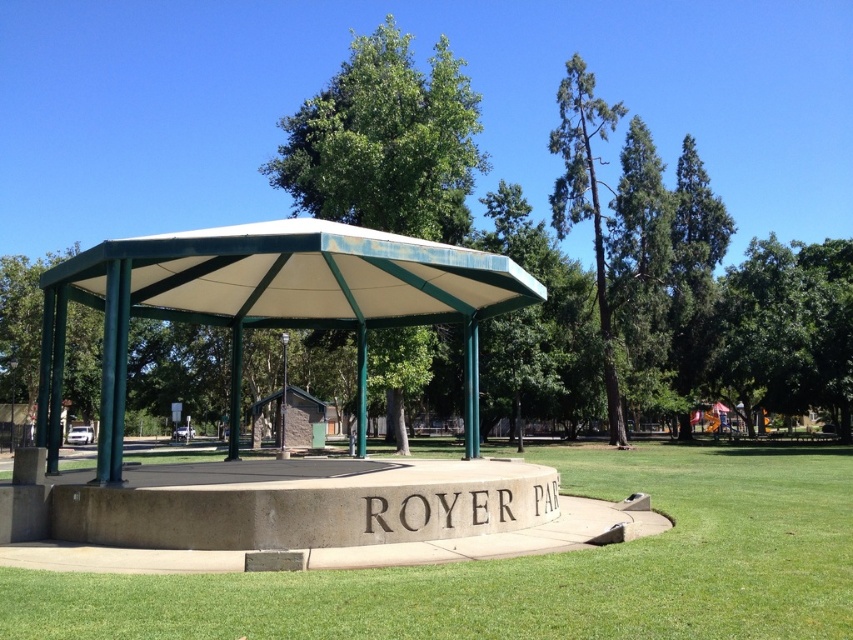
Is green fabric canopy at center taller than green textured tree at upper right?

No, green fabric canopy at center is not taller than green textured tree at upper right.

Who is higher up, green fabric canopy at center or green textured tree at upper right?

green textured tree at upper right is above.

Which is behind, point (323, 316) or point (592, 125)?

The point (592, 125) is behind.

In order to click on green fabric canopy at center in this screenshot , I will do `click(270, 304)`.

Does green leafy tree at center have a greater width compared to green textured tree at upper right?

Yes.

In the scene shown: Does green leafy tree at center appear under green textured tree at upper right?

Indeed, green leafy tree at center is positioned under green textured tree at upper right.

Which is behind, point (451, 145) or point (554, 184)?

Point (554, 184)

The width and height of the screenshot is (853, 640). Identify the location of green leafy tree at center. (386, 141).

Who is positioned more to the left, green grass at center or green fabric canopy at center?

Positioned to the left is green fabric canopy at center.

Which of these two, green grass at center or green fabric canopy at center, stands taller?

green fabric canopy at center is taller.

Between point (527, 592) and point (376, 291), which one is positioned in front?

Point (527, 592)

What are the coordinates of `green grass at center` in the screenshot? It's located at (532, 570).